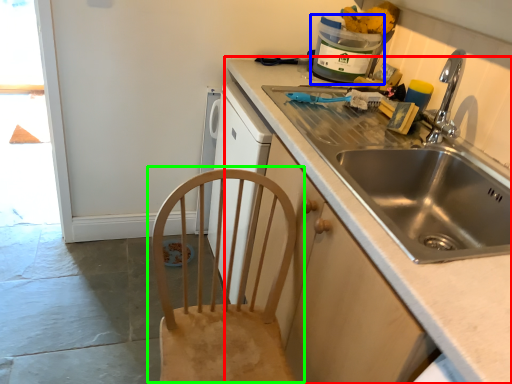
Question: Estimate the real-world distances between objects in this image. Which object is farther from countertop (highlighted by a red box), appliance (highlighted by a blue box) or chair (highlighted by a green box)?

Choices:
 (A) appliance
 (B) chair

Answer: (A)